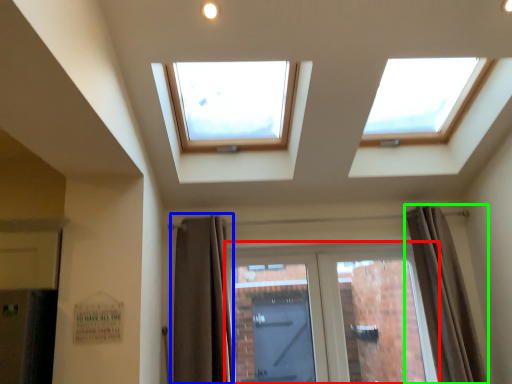
Question: Estimate the real-world distances between objects in this image. Which object is closer to door (highlighted by a red box), curtain (highlighted by a blue box) or curtain (highlighted by a green box)?

Choices:
 (A) curtain
 (B) curtain

Answer: (B)